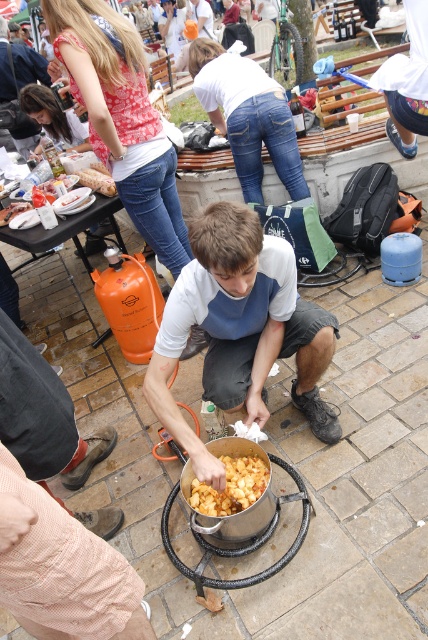
Does point (208, 381) come in front of point (231, 460)?

Yes, point (208, 381) is closer to viewer.

Is point (219, 332) positioned behind point (235, 506)?

Yes.

What do you see at coordinates (240, 328) in the screenshot?
I see `matte white shirt at center` at bounding box center [240, 328].

Identify the location of matte white shirt at center. The height and width of the screenshot is (640, 428). (240, 328).